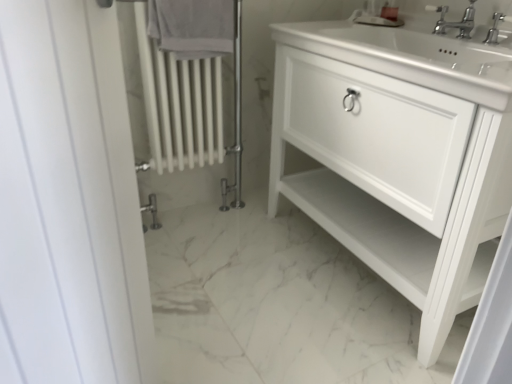
The image size is (512, 384). I want to click on unoccupied space behind polished chrome faucet at upper right, marked as the first tap in a left-to-right arrangement, so click(418, 36).